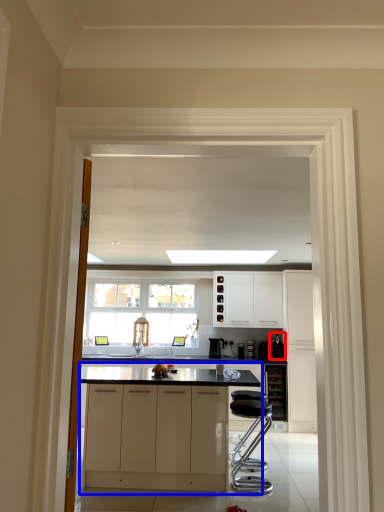
Question: Which point is closer to the camera, appliance (highlighted by a red box) or cabinetry (highlighted by a blue box)?

Choices:
 (A) appliance
 (B) cabinetry

Answer: (B)